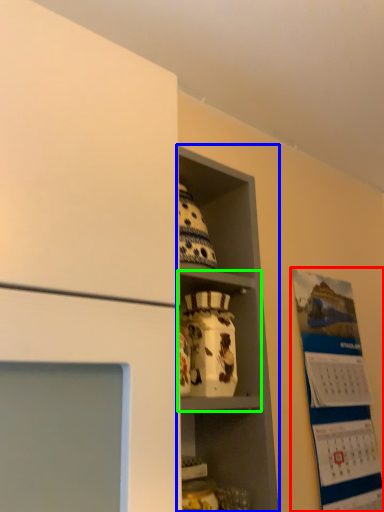
Question: Which is nearer to the bulletin board (highlighted by a red box)? shelf (highlighted by a blue box) or cabinet (highlighted by a green box).

Choices:
 (A) shelf
 (B) cabinet

Answer: (A)